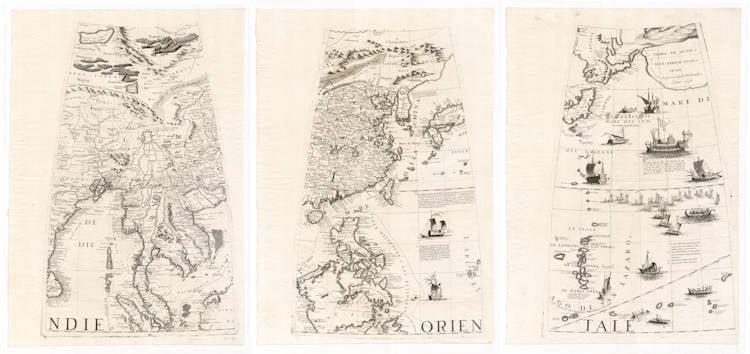
The image size is (750, 354). I want to click on window, so click(655, 147), click(660, 151), click(667, 152), click(676, 157).